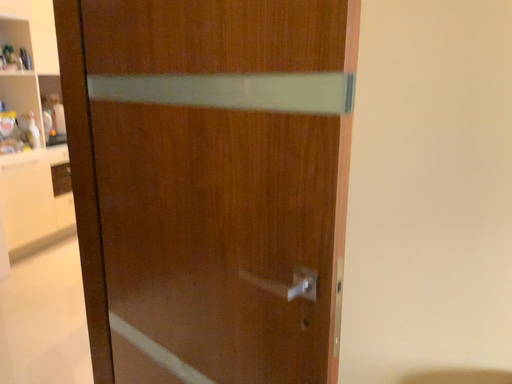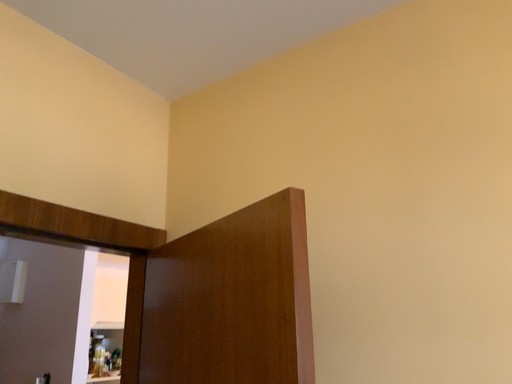
Question: How did the camera likely rotate when shooting the video?

Choices:
 (A) rotated right
 (B) rotated left

Answer: (B)